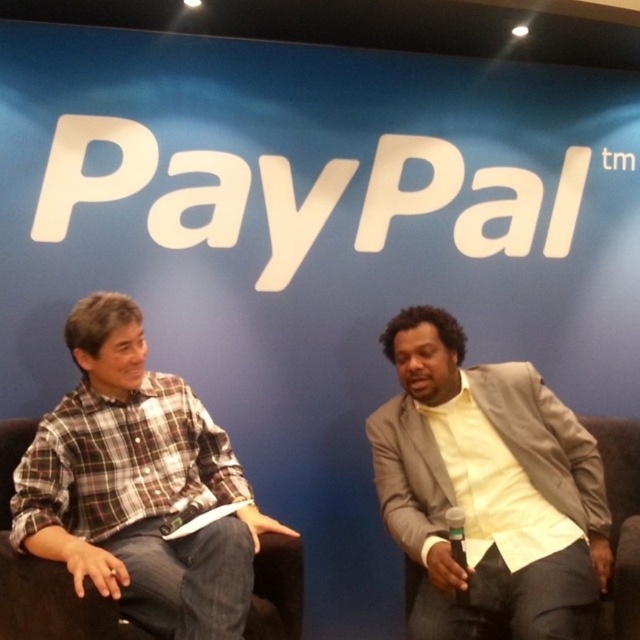
Question: Which object appears farthest from the camera in this image?

Choices:
 (A) plaid cotton shirt at left
 (B) light beige textured blazer at right

Answer: (B)

Question: Observing the image, what is the correct spatial positioning of light beige textured blazer at right in reference to plaid cotton shirt at left?

Choices:
 (A) left
 (B) right

Answer: (B)

Question: Among these points, which one is farthest from the camera?

Choices:
 (A) (422, 508)
 (B) (147, 404)

Answer: (B)

Question: Is light beige textured blazer at right positioned in front of plaid cotton shirt at left?

Choices:
 (A) yes
 (B) no

Answer: (B)

Question: Among these objects, which one is nearest to the camera?

Choices:
 (A) light beige textured blazer at right
 (B) plaid cotton shirt at left

Answer: (B)

Question: Can you confirm if light beige textured blazer at right is bigger than plaid cotton shirt at left?

Choices:
 (A) yes
 (B) no

Answer: (B)